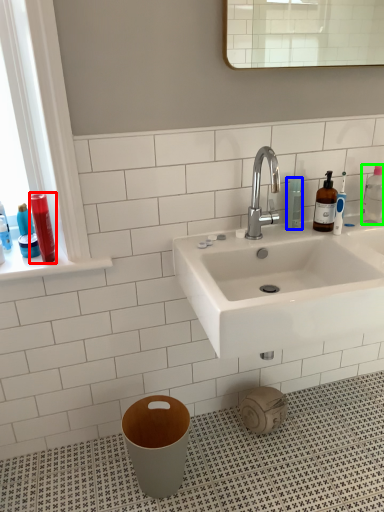
Question: Considering the real-world distances, which object is closest to toiletry (highlighted by a red box)? mouthwash (highlighted by a blue box) or cleaning product (highlighted by a green box).

Choices:
 (A) mouthwash
 (B) cleaning product

Answer: (A)